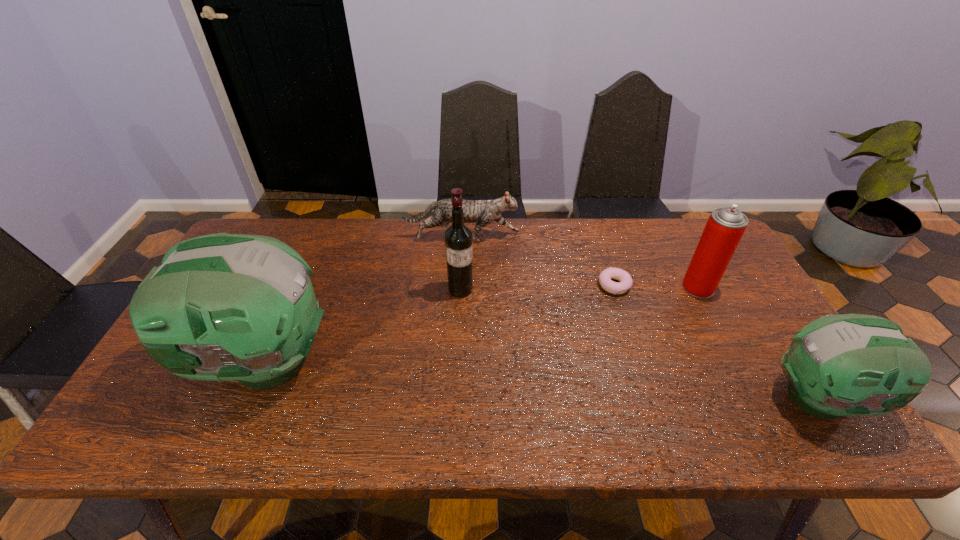
Locate an element on the screen. This screenshot has width=960, height=540. object that is at the near right corner is located at coordinates (839, 365).

Locate an element on the screen. Image resolution: width=960 pixels, height=540 pixels. vacant space at the far edge of the desktop is located at coordinates (316, 260).

At what (x,y) coordinates should I click in order to perform the action: click on vacant space at the near edge. Please return your answer as a coordinate pair (x, y). This screenshot has width=960, height=540. Looking at the image, I should click on (681, 398).

This screenshot has height=540, width=960. In the image, there is a desktop. What are the coordinates of `vacant space at the right edge` in the screenshot? It's located at (764, 361).

This screenshot has height=540, width=960. What are the coordinates of `free space at the far left corner of the desktop` in the screenshot? It's located at (292, 224).

Identify the location of free spot between the doughnut and the shorter football helmet. The height and width of the screenshot is (540, 960). (718, 342).

Where is `vacant region between the taller football helmet and the fourth tallest object`? The height and width of the screenshot is (540, 960). vacant region between the taller football helmet and the fourth tallest object is located at coordinates (541, 380).

Identify the location of vacant point located between the right football helmet and the wine bottle. (641, 344).

Find the location of a particular element. Image resolution: width=960 pixels, height=540 pixels. vacant space that's between the shortest object and the wine bottle is located at coordinates coord(538,288).

This screenshot has width=960, height=540. I want to click on blank region between the leftmost object and the shortest object, so click(x=438, y=323).